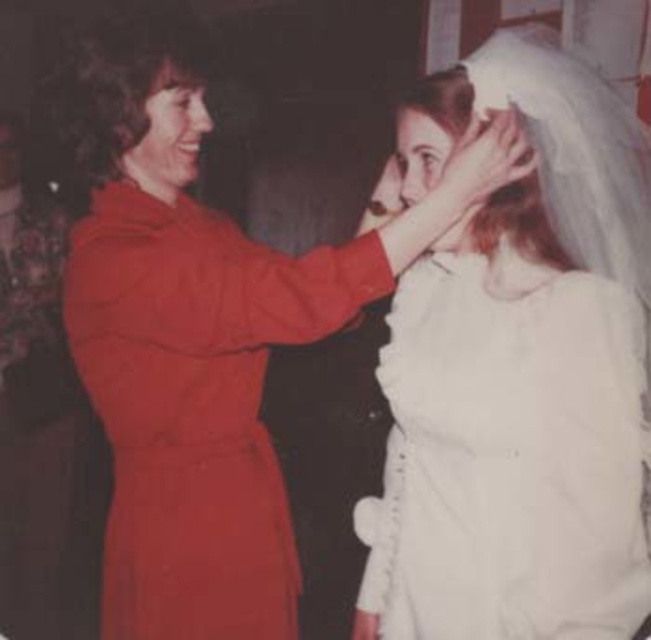
Question: Can you confirm if white satin veil at upper center is wider than matte red dress at center?

Choices:
 (A) yes
 (B) no

Answer: (B)

Question: Does white satin veil at upper center appear under matte red dress at center?

Choices:
 (A) yes
 (B) no

Answer: (A)

Question: Which point is farther from the camera taking this photo?

Choices:
 (A) (365, 259)
 (B) (436, 452)

Answer: (B)

Question: Which object is closer to the camera taking this photo?

Choices:
 (A) white satin veil at upper center
 (B) matte red dress at center

Answer: (A)

Question: Does white satin veil at upper center have a lesser width compared to matte red dress at center?

Choices:
 (A) no
 (B) yes

Answer: (B)